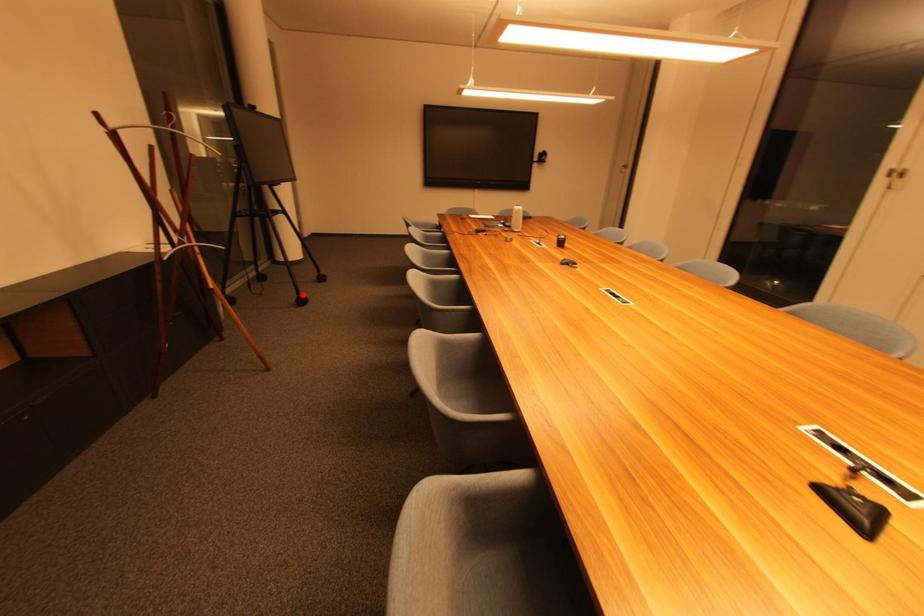
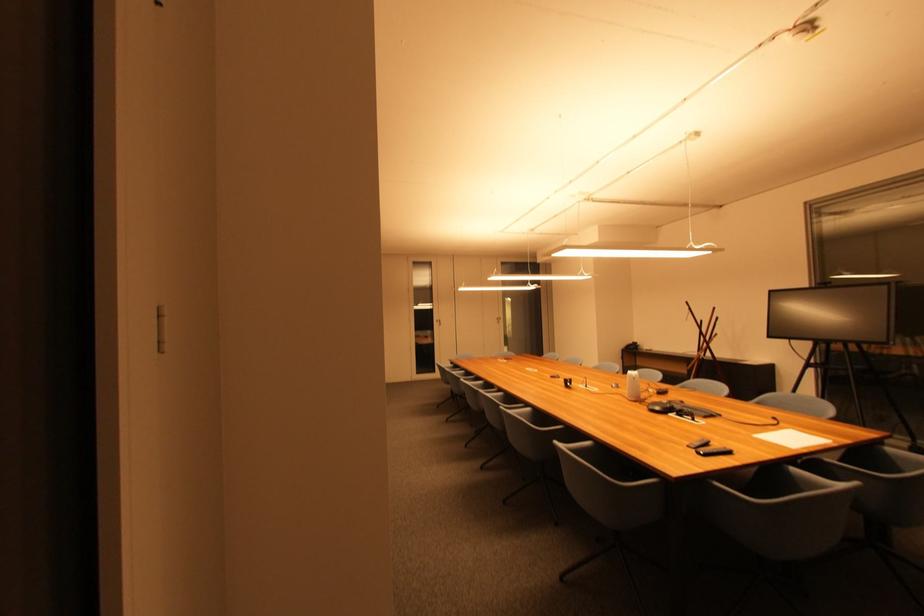
Question: I am providing you with two images of the same scene from different viewpoints. A red point is marked on the first image. Is the red point's position out of view in image 2?

Choices:
 (A) Yes
 (B) No

Answer: (A)